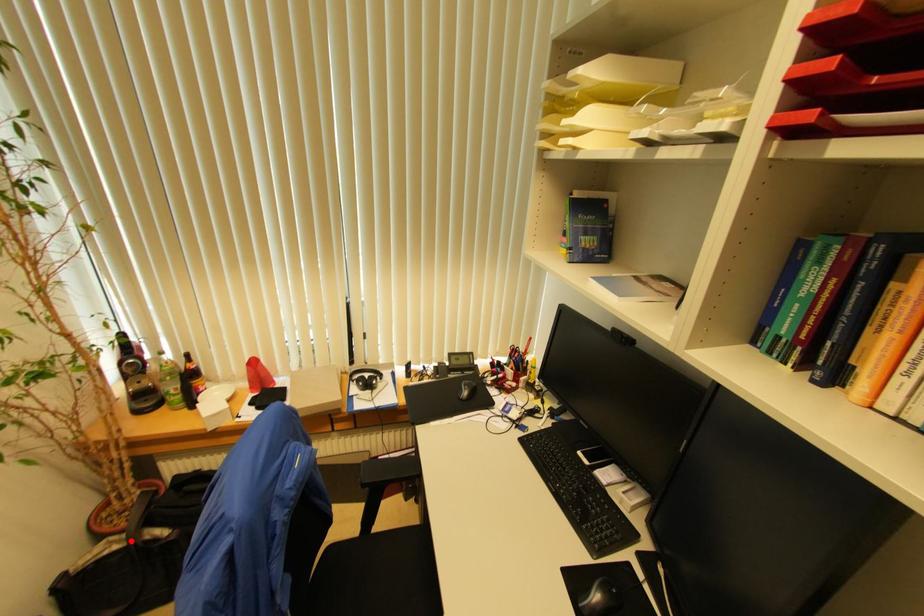
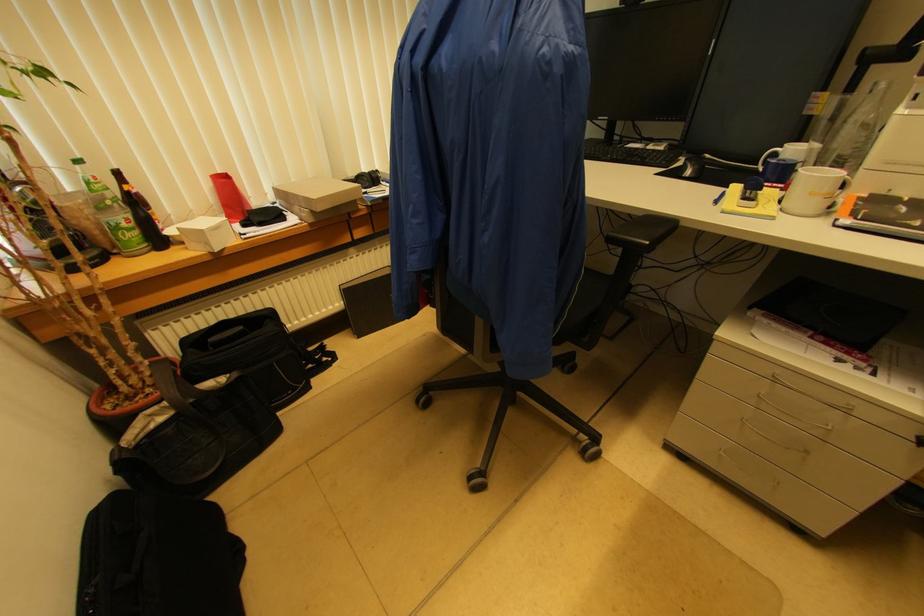
Where in the second image is the point corresponding to the highlighted location from the first image?

(175, 408)